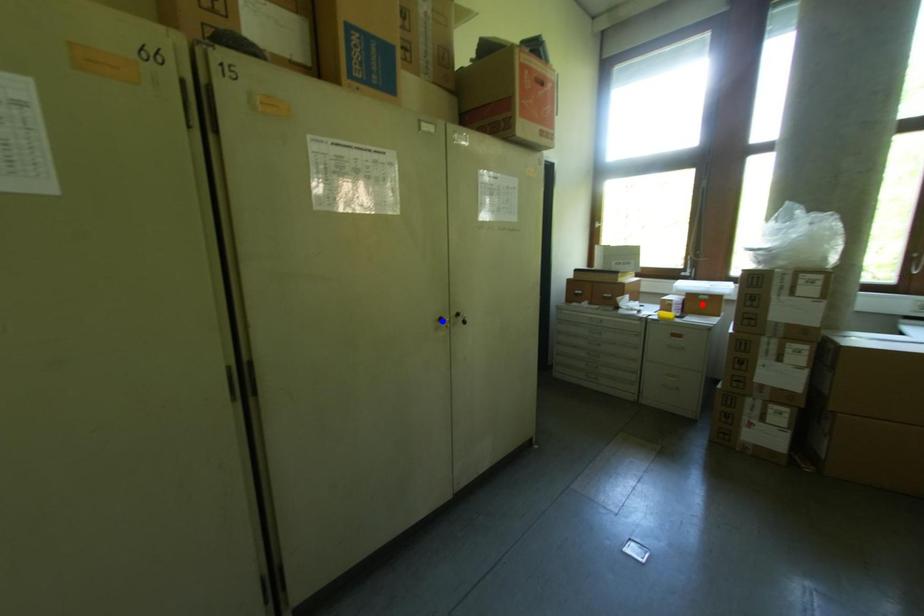
Question: Which of the two points in the image is closer to the camera?

Choices:
 (A) Blue point is closer.
 (B) Red point is closer.

Answer: (A)